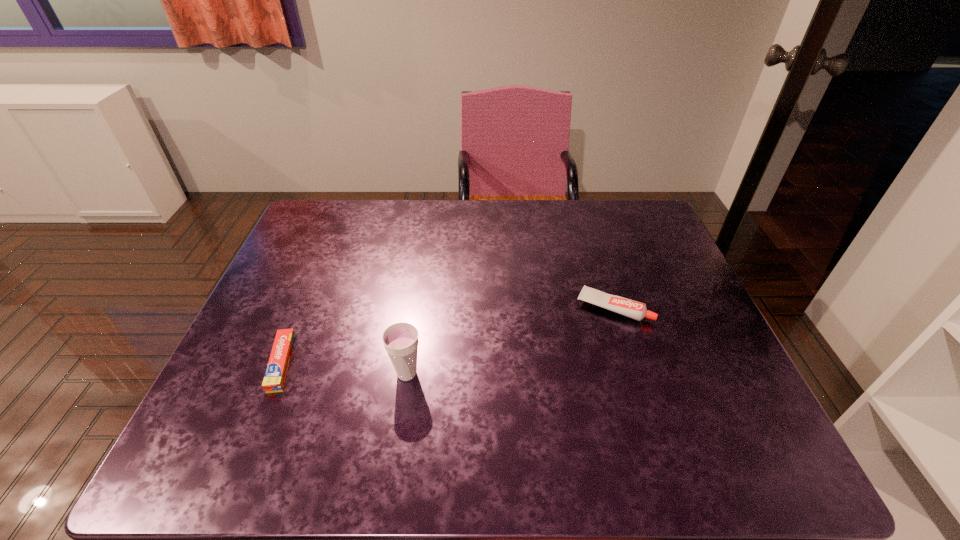
In order to click on cup in this screenshot , I will do `click(400, 340)`.

You are a GUI agent. You are given a task and a screenshot of the screen. Output one action in this format:
    pyautogui.click(x=<x>, y=<y>)
    Task: Click on the tallest object
    The height and width of the screenshot is (540, 960).
    Given the screenshot: What is the action you would take?
    (400, 340)

Locate an element on the screen. the rightmost object is located at coordinates (630, 308).

At what (x,y) coordinates should I click in order to perform the action: click on the second shortest object. Please return your answer as a coordinate pair (x, y). Image resolution: width=960 pixels, height=540 pixels. Looking at the image, I should click on (630, 308).

Find the location of a particular element. the left toothpaste is located at coordinates (275, 377).

Where is `the shorter toothpaste`? This screenshot has height=540, width=960. the shorter toothpaste is located at coordinates (275, 377).

Locate an element on the screen. The image size is (960, 540). vacant space situated 0.050m on the left of the tallest object is located at coordinates (368, 374).

Where is `vacant space situated on the back of the farther toothpaste`? vacant space situated on the back of the farther toothpaste is located at coordinates (599, 259).

The height and width of the screenshot is (540, 960). I want to click on free spot located 0.060m on the left of the nearer toothpaste, so click(x=243, y=363).

Image resolution: width=960 pixels, height=540 pixels. Identify the location of object situated at the left edge. (275, 377).